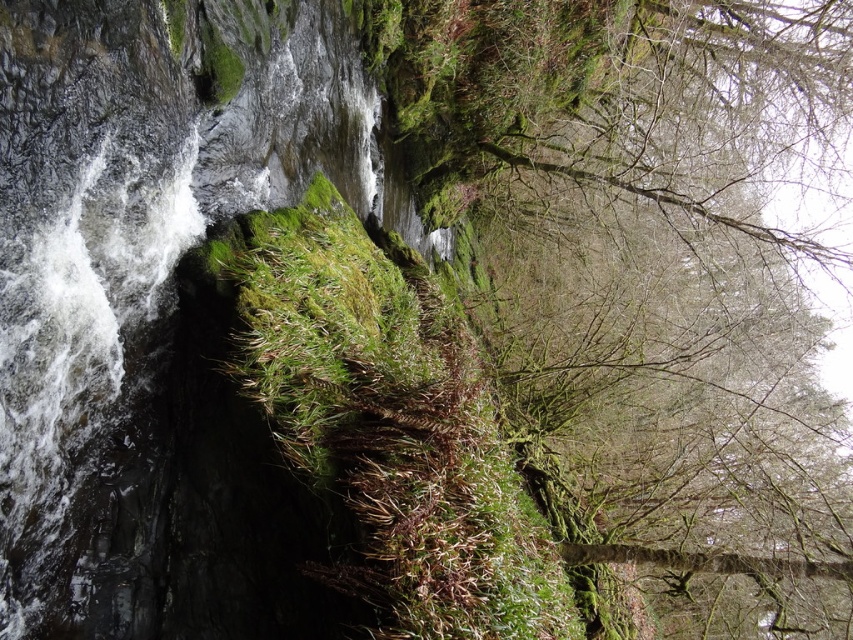
Between clear water at left and green mossy rock at center, which one is positioned lower?

green mossy rock at center is below.

Is point (0, 84) less distant than point (439, 628)?

That is False.

In order to click on clear water at left in this screenshot , I will do `click(137, 230)`.

Is green mossy tree at upper center to the right of green mossy rock at center from the viewer's perspective?

Yes, green mossy tree at upper center is to the right of green mossy rock at center.

Between point (553, 99) and point (335, 356), which one is positioned in front?

Point (335, 356)

You are a GUI agent. You are given a task and a screenshot of the screen. Output one action in this format:
    pyautogui.click(x=<x>, y=<y>)
    Task: Click on the green mossy tree at upper center
    
    Given the screenshot: What is the action you would take?
    pyautogui.click(x=640, y=236)

Between green mossy tree at upper center and clear water at left, which one appears on the left side from the viewer's perspective?

clear water at left

Can you confirm if green mossy tree at upper center is smaller than clear water at left?

Actually, green mossy tree at upper center might be larger than clear water at left.

Which is in front, point (730, 182) or point (155, 49)?

Positioned in front is point (155, 49).

The image size is (853, 640). What are the coordinates of `green mossy tree at upper center` in the screenshot? It's located at (640, 236).